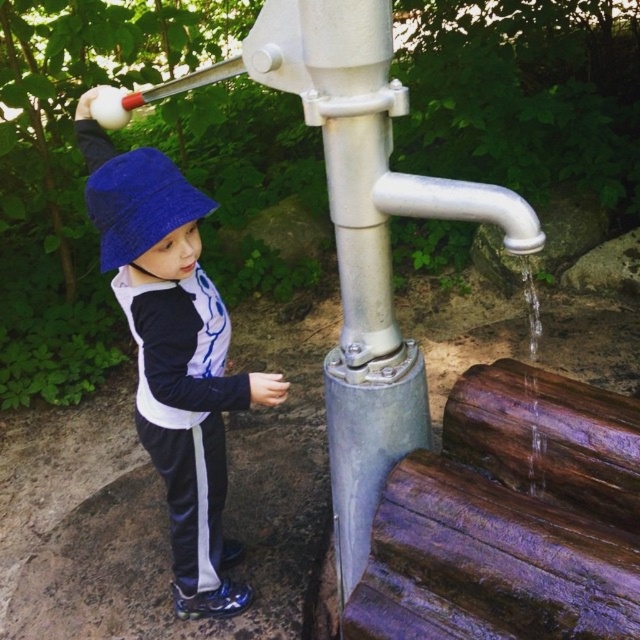
Who is positioned more to the right, matte blue bucket hat at left or clear water at lower right?

clear water at lower right

Which is above, matte blue bucket hat at left or clear water at lower right?

clear water at lower right is above.

Is point (196, 410) positioned after point (532, 451)?

That is True.

At what (x,y) coordinates should I click in order to perform the action: click on matte blue bucket hat at left. Please return your answer as a coordinate pair (x, y). The image size is (640, 640). Looking at the image, I should click on (173, 352).

Who is more forward, (224,600) or (100,152)?

Point (100,152)

Is point (88, 200) less distant than point (118, 173)?

No.

Identify the location of matte blue bucket hat at left. (173, 352).

Is blue knitted hat at left further to the viewer compared to clear water at lower right?

No, it is not.

Which of these two, blue knitted hat at left or clear water at lower right, stands shorter?

blue knitted hat at left

Which is behind, point (161, 192) or point (532, 362)?

The point (532, 362) is more distant.

Image resolution: width=640 pixels, height=640 pixels. Identify the location of blue knitted hat at left. [140, 204].